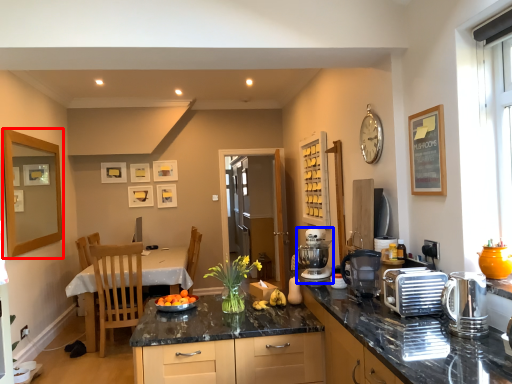
Question: Which of the following is the closest to the observer, picture frame (highlighted by a red box) or mixer (highlighted by a blue box)?

Choices:
 (A) picture frame
 (B) mixer

Answer: (B)